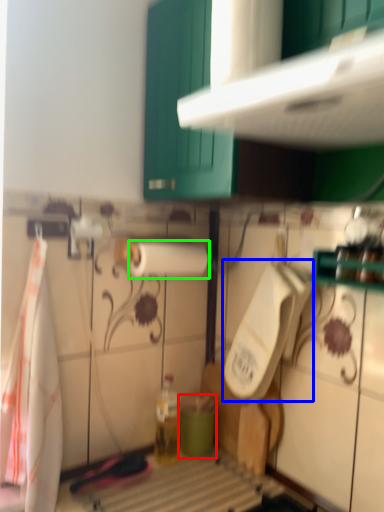
Question: Considering the real-world distances, which object is closest to teal (highlighted by a red box)? urinal (highlighted by a blue box) or paper towel (highlighted by a green box).

Choices:
 (A) urinal
 (B) paper towel

Answer: (A)